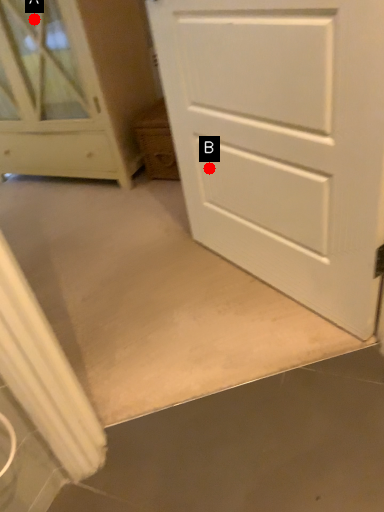
Question: Two points are circled on the image, labeled by A and B beside each circle. Which point is further to the camera?

Choices:
 (A) A is further
 (B) B is further

Answer: (A)